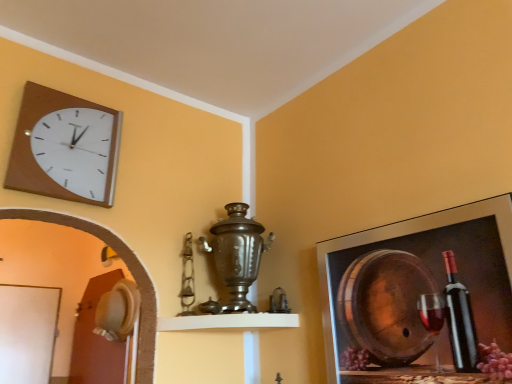
You are a GUI agent. You are given a task and a screenshot of the screen. Output one action in this format:
    pyautogui.click(x=<x>, y=<y>)
    Task: Click on the free point above metallic frame at upper right (from a real-world perspective)
    Image resolution: width=512 pixels, height=384 pixels.
    Given the screenshot: What is the action you would take?
    pyautogui.click(x=409, y=218)